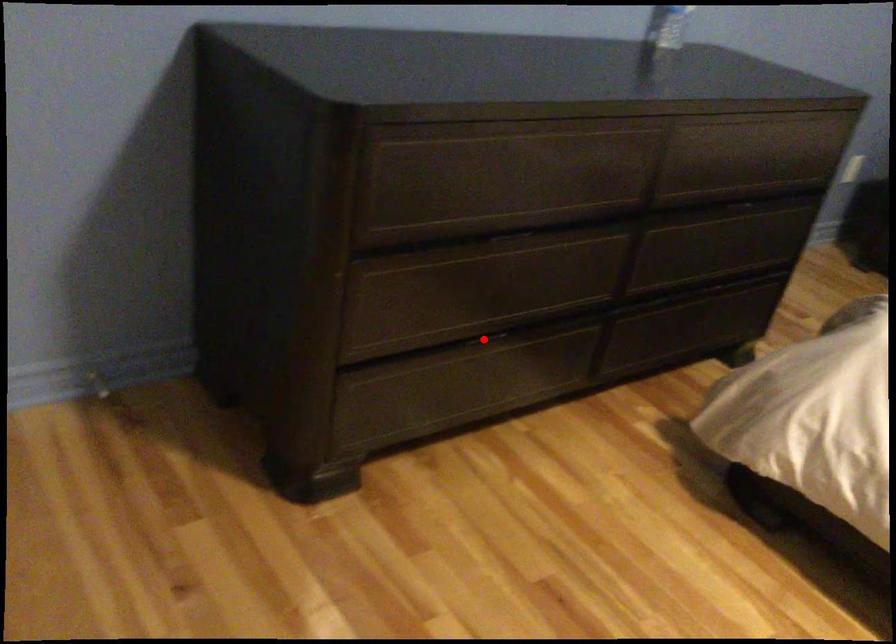
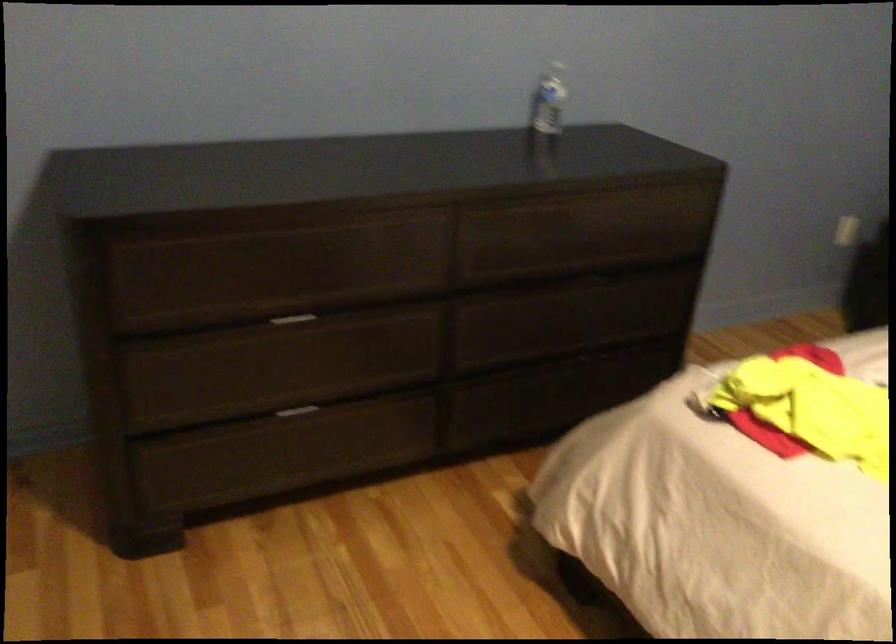
Question: I am providing you with two images of the same scene from different viewpoints. A red point is shown in image1. For the corresponding object point in image2, is it positioned nearer or farther from the camera?

Choices:
 (A) Nearer
 (B) Farther

Answer: (B)